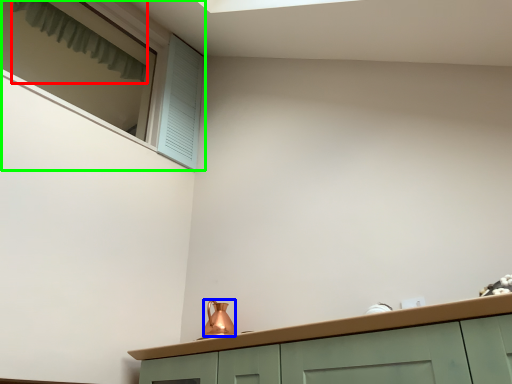
Question: Estimate the real-world distances between objects in this image. Which object is farther from curtain (highlighted by a red box), tea pot (highlighted by a blue box) or window (highlighted by a green box)?

Choices:
 (A) tea pot
 (B) window

Answer: (A)